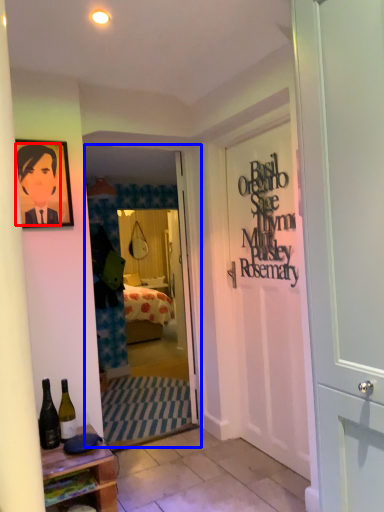
Question: Which point is further to the camera, person (highlighted by a red box) or screen door (highlighted by a blue box)?

Choices:
 (A) person
 (B) screen door

Answer: (B)